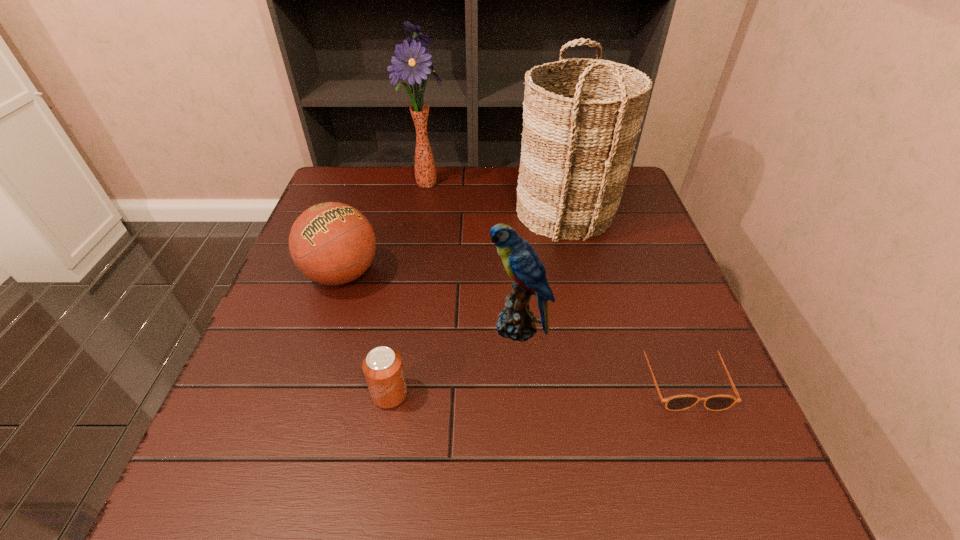
The image size is (960, 540). I want to click on free space between the basketball and the can, so click(x=366, y=334).

Image resolution: width=960 pixels, height=540 pixels. I want to click on unoccupied area between the flower arrangement and the sunglasses, so click(554, 280).

Where is `free space between the basket and the flower arrangement`? The height and width of the screenshot is (540, 960). free space between the basket and the flower arrangement is located at coordinates (495, 197).

Locate an element on the screen. This screenshot has height=540, width=960. empty space between the second shortest object and the sunglasses is located at coordinates (536, 386).

Identify the location of vacant area between the fourth tallest object and the basket. (454, 242).

Find the location of a particular element. This screenshot has height=540, width=960. the fourth closest object relative to the basket is located at coordinates (332, 243).

Locate an element on the screen. object that is the third closest to the basket is located at coordinates (678, 402).

You are a GUI agent. You are given a task and a screenshot of the screen. Output one action in this format:
    pyautogui.click(x=<x>, y=<y>)
    Task: Click on the blank space that satisfies the following two spatial constraints: 1. on the back side of the basket; 2. on the left side of the fifth tallest object
    The height and width of the screenshot is (540, 960).
    Given the screenshot: What is the action you would take?
    click(420, 211)